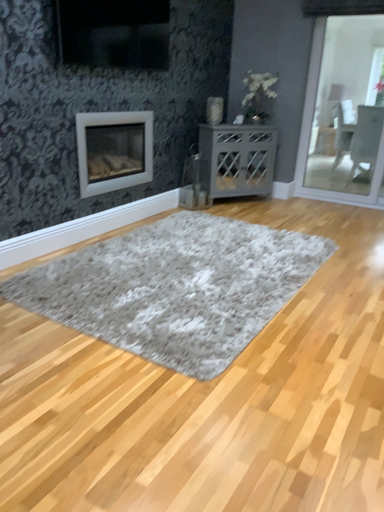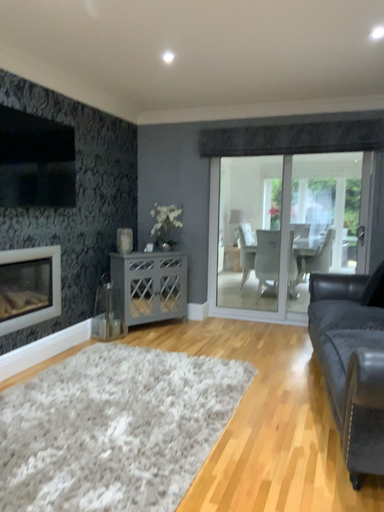
Question: Which way did the camera rotate in the video?

Choices:
 (A) rotated upward
 (B) rotated downward

Answer: (A)